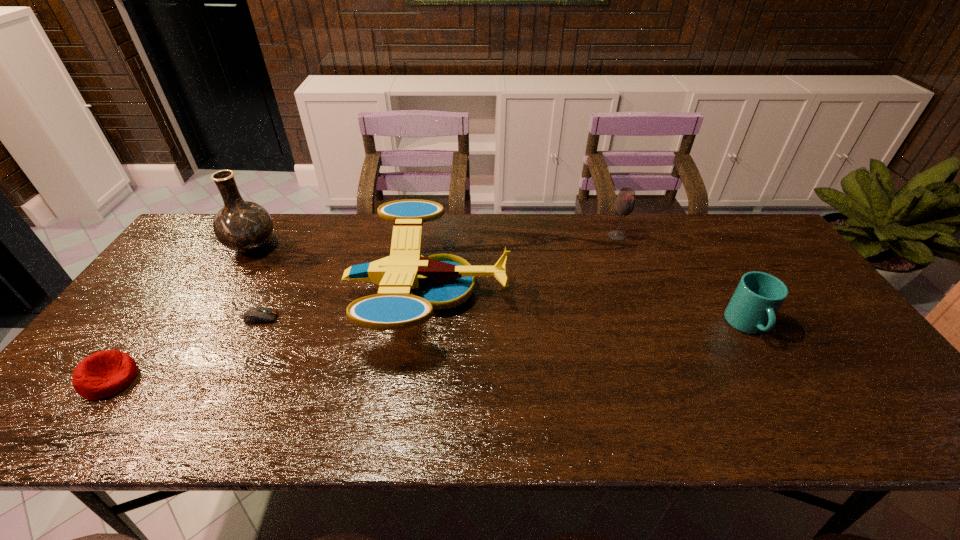
Where is `beanbag at the left edge`? This screenshot has height=540, width=960. beanbag at the left edge is located at coordinates (103, 374).

I want to click on object at the far left corner, so click(x=242, y=226).

Identify the location of object located in the near left corner section of the desktop. The image size is (960, 540). (103, 374).

In the image, there is a desktop. Identify the location of free region at the far edge. This screenshot has height=540, width=960. (589, 248).

Where is `vacant space at the near edge of the desktop`? The image size is (960, 540). vacant space at the near edge of the desktop is located at coordinates (309, 423).

The height and width of the screenshot is (540, 960). I want to click on blank space at the far left corner, so click(x=227, y=253).

This screenshot has height=540, width=960. I want to click on vacant position at the far right corner of the desktop, so click(x=731, y=237).

Find the location of a particular element. Image resolution: width=960 pixels, height=540 pixels. vacant space at the near right corner of the desktop is located at coordinates (918, 416).

The height and width of the screenshot is (540, 960). I want to click on empty space between the cup and the glass drink container, so click(x=682, y=281).

The width and height of the screenshot is (960, 540). What are the coordinates of `vacant region between the glass drink container and the tallest object` in the screenshot? It's located at (435, 241).